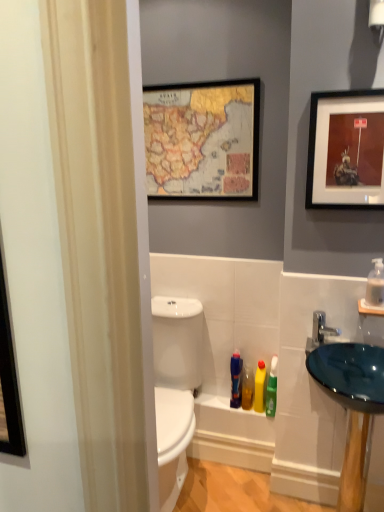
What is the approximate width of translucent plastic bottle at lower center, which appears as the 1th toiletry when viewed from the left?

translucent plastic bottle at lower center, which appears as the 1th toiletry when viewed from the left, is 4.94 inches wide.

Locate an element on the screen. Image resolution: width=384 pixels, height=512 pixels. yellow glossy bottle at lower center, arranged as the 3th toiletry when viewed from the left is located at coordinates (259, 387).

Locate an element on the screen. translucent green bottle at lower center, the 4th toiletry when ordered from left to right is located at coordinates (272, 389).

Where is `wooden framed picture at upper right, which is the 1th picture frame in right-to-left order`? The image size is (384, 512). wooden framed picture at upper right, which is the 1th picture frame in right-to-left order is located at coordinates (346, 150).

What do you see at coordinates (350, 403) in the screenshot? The height and width of the screenshot is (512, 384). I see `teal glass sink at right` at bounding box center [350, 403].

The height and width of the screenshot is (512, 384). I want to click on silver metallic faucet at right, so click(322, 328).

How much distance is there between yellow glossy bottle at lower center, the 2th toiletry from the right, and silver metallic faucet at right?

A distance of 46.95 centimeters exists between yellow glossy bottle at lower center, the 2th toiletry from the right, and silver metallic faucet at right.

Considering the sizes of yellow glossy bottle at lower center, arranged as the 3th toiletry when viewed from the left, and silver metallic faucet at right in the image, is yellow glossy bottle at lower center, arranged as the 3th toiletry when viewed from the left, taller or shorter than silver metallic faucet at right?

Clearly, yellow glossy bottle at lower center, arranged as the 3th toiletry when viewed from the left, is taller compared to silver metallic faucet at right.

Can you confirm if yellow glossy bottle at lower center, the 2th toiletry from the right, is smaller than silver metallic faucet at right?

Yes, yellow glossy bottle at lower center, the 2th toiletry from the right, is smaller than silver metallic faucet at right.

Considering the positions of objects yellow glossy bottle at lower center, the 2th toiletry from the right, and silver metallic faucet at right in the image provided, who is more to the left, yellow glossy bottle at lower center, the 2th toiletry from the right, or silver metallic faucet at right?

yellow glossy bottle at lower center, the 2th toiletry from the right.

From a real-world perspective, which is physically below, wooden-framed map at upper center, placed as the 2th picture frame when sorted from front to back, or translucent plastic bottle at lower center, which appears as the 1th toiletry when viewed from the left?

translucent plastic bottle at lower center, which appears as the 1th toiletry when viewed from the left, is physically lower.

Considering the sizes of wooden-framed map at upper center, which is the 1th picture frame from back to front, and translucent plastic bottle at lower center, placed as the fourth toiletry when sorted from right to left, in the image, is wooden-framed map at upper center, which is the 1th picture frame from back to front, bigger or smaller than translucent plastic bottle at lower center, placed as the fourth toiletry when sorted from right to left,?

In the image, wooden-framed map at upper center, which is the 1th picture frame from back to front, appears to be larger than translucent plastic bottle at lower center, placed as the fourth toiletry when sorted from right to left.

Which is behind, wooden-framed map at upper center, positioned as the 1th picture frame in left-to-right order, or translucent plastic bottle at lower center, which appears as the 1th toiletry when viewed from the left?

translucent plastic bottle at lower center, which appears as the 1th toiletry when viewed from the left, is further from the camera.

Can you confirm if wooden-framed map at upper center, positioned as the 1th picture frame in left-to-right order, is thinner than translucent plastic bottle at lower center, which appears as the 1th toiletry when viewed from the left?

Correct, the width of wooden-framed map at upper center, positioned as the 1th picture frame in left-to-right order, is less than that of translucent plastic bottle at lower center, which appears as the 1th toiletry when viewed from the left.

Is point (254, 175) less distant than point (247, 374)?

Yes, point (254, 175) is closer to viewer.

Is wooden-framed map at upper center, placed as the 2th picture frame when sorted from front to back, not close to translucent plastic bottle at lower center, marked as the 3th toiletry in a right-to-left arrangement?

wooden-framed map at upper center, placed as the 2th picture frame when sorted from front to back, is far away from translucent plastic bottle at lower center, marked as the 3th toiletry in a right-to-left arrangement.

Considering the relative sizes of wooden-framed map at upper center, which is the 1th picture frame from back to front, and translucent plastic bottle at lower center, the 2th toiletry in the left-to-right sequence, in the image provided, is wooden-framed map at upper center, which is the 1th picture frame from back to front, thinner than translucent plastic bottle at lower center, the 2th toiletry in the left-to-right sequence,?

Yes.

From a real-world perspective, which is physically below, wooden-framed map at upper center, positioned as the 1th picture frame in left-to-right order, or translucent plastic bottle at lower center, the 2th toiletry in the left-to-right sequence?

translucent plastic bottle at lower center, the 2th toiletry in the left-to-right sequence, from a real-world perspective.

Find the location of a particular element. tap above the teal glass sink at right (from the image's perspective) is located at coordinates (322, 328).

Does silver metallic faucet at right touch teal glass sink at right?

No, silver metallic faucet at right is not touching teal glass sink at right.

From a real-world perspective, which object rests below the other?

From a 3D spatial view, teal glass sink at right is below.

Can you confirm if blue glass sink at right is positioned to the right of translucent plastic bottle at lower center, placed as the fourth toiletry when sorted from right to left?

Yes, blue glass sink at right is to the right of translucent plastic bottle at lower center, placed as the fourth toiletry when sorted from right to left.

Is blue glass sink at right in contact with translucent plastic bottle at lower center, placed as the fourth toiletry when sorted from right to left?

blue glass sink at right and translucent plastic bottle at lower center, placed as the fourth toiletry when sorted from right to left, are not in contact.

From the picture: From the image's perspective, does blue glass sink at right appear higher than translucent plastic bottle at lower center, which appears as the 1th toiletry when viewed from the left?

Yes, from the image's perspective, blue glass sink at right is over translucent plastic bottle at lower center, which appears as the 1th toiletry when viewed from the left.

Measure the distance between wooden-framed map at upper center, the second picture frame in the right-to-left sequence, and translucent green bottle at lower center, placed as the first toiletry when sorted from right to left.

wooden-framed map at upper center, the second picture frame in the right-to-left sequence, and translucent green bottle at lower center, placed as the first toiletry when sorted from right to left, are 3.53 feet apart.

Could you tell me if wooden-framed map at upper center, the second picture frame in the right-to-left sequence, is turned towards translucent green bottle at lower center, the 4th toiletry when ordered from left to right?

No, wooden-framed map at upper center, the second picture frame in the right-to-left sequence, is not aimed at translucent green bottle at lower center, the 4th toiletry when ordered from left to right.

From a real-world perspective, does wooden-framed map at upper center, placed as the 2th picture frame when sorted from front to back, stand above translucent green bottle at lower center, the 4th toiletry when ordered from left to right?

Correct, in the physical world, wooden-framed map at upper center, placed as the 2th picture frame when sorted from front to back, is higher than translucent green bottle at lower center, the 4th toiletry when ordered from left to right.

Considering the relative positions of wooden-framed map at upper center, placed as the 2th picture frame when sorted from front to back, and translucent green bottle at lower center, placed as the first toiletry when sorted from right to left, in the image provided, is wooden-framed map at upper center, placed as the 2th picture frame when sorted from front to back, to the left of translucent green bottle at lower center, placed as the first toiletry when sorted from right to left, from the viewer's perspective?

Indeed, wooden-framed map at upper center, placed as the 2th picture frame when sorted from front to back, is positioned on the left side of translucent green bottle at lower center, placed as the first toiletry when sorted from right to left.

Is wooden framed picture at upper right, which is the 1th picture frame in right-to-left order, inside silver metallic faucet at right?

No, wooden framed picture at upper right, which is the 1th picture frame in right-to-left order, is not inside silver metallic faucet at right.

Who is taller, silver metallic faucet at right or wooden framed picture at upper right, the second picture frame in the left-to-right sequence?

Standing taller between the two is wooden framed picture at upper right, the second picture frame in the left-to-right sequence.

Based on the photo, from a real-world perspective, is silver metallic faucet at right above or below wooden framed picture at upper right, placed as the first picture frame when sorted from front to back?

In terms of real-world spatial position, silver metallic faucet at right is below wooden framed picture at upper right, placed as the first picture frame when sorted from front to back.

The image size is (384, 512). Find the location of `tap that is behind the wooden framed picture at upper right, which appears as the second picture frame when viewed from the back`. tap that is behind the wooden framed picture at upper right, which appears as the second picture frame when viewed from the back is located at coordinates (322, 328).

Find the location of a particular element. Image resolution: width=384 pixels, height=512 pixels. tap above the yellow glossy bottle at lower center, the 2th toiletry from the right (from the image's perspective) is located at coordinates (322, 328).

Where is `the 1st picture frame in front of the translucent plastic bottle at lower center, placed as the fourth toiletry when sorted from right to left, counting from the anchor's position`? the 1st picture frame in front of the translucent plastic bottle at lower center, placed as the fourth toiletry when sorted from right to left, counting from the anchor's position is located at coordinates (202, 140).

Which object lies further to the anchor point translucent plastic soap dispenser at right, translucent green bottle at lower center, the 4th toiletry when ordered from left to right, or translucent plastic bottle at lower center, marked as the 3th toiletry in a right-to-left arrangement?

translucent plastic bottle at lower center, marked as the 3th toiletry in a right-to-left arrangement, lies further to translucent plastic soap dispenser at right than the other object.

Which object lies nearer to the anchor point yellow glossy bottle at lower center, arranged as the 3th toiletry when viewed from the left, wooden framed picture at upper right, which appears as the second picture frame when viewed from the back, or silver metallic faucet at right?

silver metallic faucet at right is positioned closer to the anchor yellow glossy bottle at lower center, arranged as the 3th toiletry when viewed from the left.

Based on their spatial positions, is translucent plastic soap dispenser at right or teal glass sink at right further from silver metallic faucet at right?

teal glass sink at right.

Based on the photo, considering their positions, is translucent plastic soap dispenser at right positioned further to teal glass sink at right than wooden framed picture at upper right, which is the 1th picture frame in right-to-left order?

Based on the image, wooden framed picture at upper right, which is the 1th picture frame in right-to-left order, appears to be further to teal glass sink at right.

From the image, which object appears to be farther from translucent plastic bottle at lower center, the 2th toiletry in the left-to-right sequence, translucent plastic bottle at lower center, which appears as the 1th toiletry when viewed from the left, or yellow glossy bottle at lower center, the 2th toiletry from the right?

yellow glossy bottle at lower center, the 2th toiletry from the right, is further to translucent plastic bottle at lower center, the 2th toiletry in the left-to-right sequence.

Which object lies nearer to the anchor point blue glass sink at right, translucent green bottle at lower center, the 4th toiletry when ordered from left to right, or wooden framed picture at upper right, which appears as the second picture frame when viewed from the back?

translucent green bottle at lower center, the 4th toiletry when ordered from left to right, lies closer to blue glass sink at right than the other object.

From the image, which object appears to be nearer to translucent plastic bottle at lower center, placed as the fourth toiletry when sorted from right to left, translucent plastic bottle at lower center, marked as the 3th toiletry in a right-to-left arrangement, or translucent plastic soap dispenser at right?

translucent plastic bottle at lower center, marked as the 3th toiletry in a right-to-left arrangement.

Looking at the image, which one is located further to blue glass sink at right, wooden-framed map at upper center, placed as the 2th picture frame when sorted from front to back, or teal glass sink at right?

wooden-framed map at upper center, placed as the 2th picture frame when sorted from front to back, lies further to blue glass sink at right than the other object.

At what (x,y) coordinates should I click in order to perform the action: click on counter top between wooden framed picture at upper right, which appears as the second picture frame when viewed from the back, and yellow glossy bottle at lower center, arranged as the 3th toiletry when viewed from the left, vertically. Please return your answer as a coordinate pair (x, y). This screenshot has width=384, height=512. Looking at the image, I should click on (370, 308).

At what (x,y) coordinates should I click in order to perform the action: click on tap located between teal glass sink at right and yellow glossy bottle at lower center, arranged as the 3th toiletry when viewed from the left, in the depth direction. Please return your answer as a coordinate pair (x, y). Looking at the image, I should click on (322, 328).

Identify the location of counter top between wooden framed picture at upper right, which appears as the second picture frame when viewed from the back, and teal glass sink at right from top to bottom. The height and width of the screenshot is (512, 384). (370, 308).

This screenshot has height=512, width=384. In order to click on tap between teal glass sink at right and translucent green bottle at lower center, placed as the first toiletry when sorted from right to left, in the front-back direction in this screenshot , I will do `click(322, 328)`.